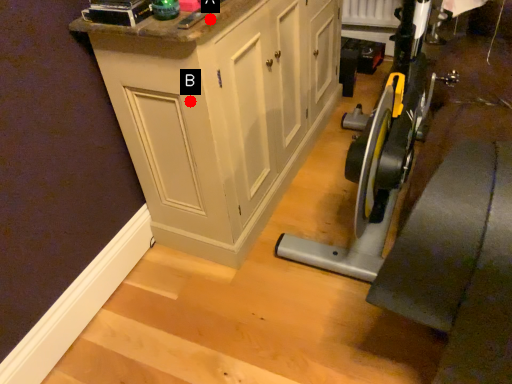
Question: Two points are circled on the image, labeled by A and B beside each circle. Which point is farther from the camera taking this photo?

Choices:
 (A) A is further
 (B) B is further

Answer: (B)